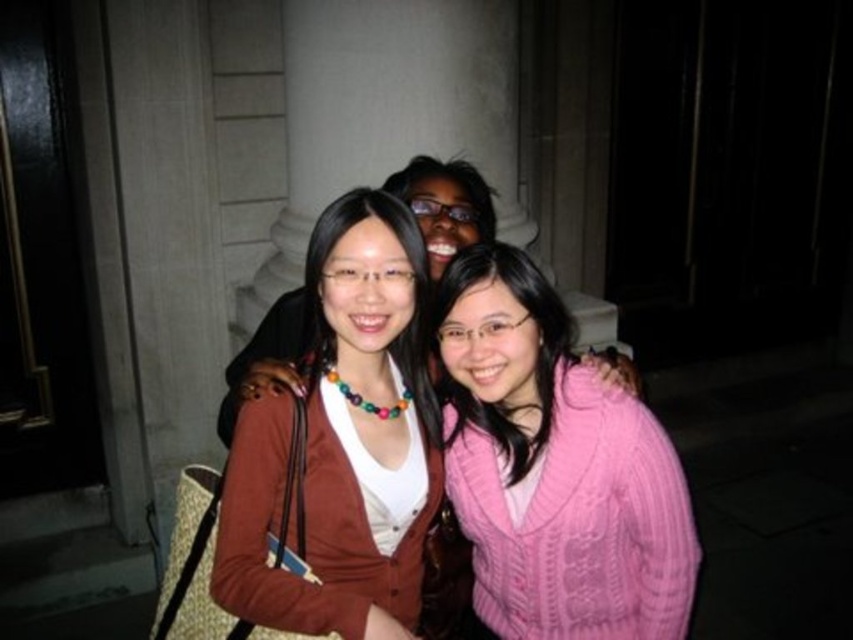
Which is above, pink knitted sweater at center or matte brown sweater at center?

Positioned higher is matte brown sweater at center.

At what (x,y) coordinates should I click in order to perform the action: click on pink knitted sweater at center. Please return your answer as a coordinate pair (x, y). The image size is (853, 640). Looking at the image, I should click on (554, 468).

Where is `brown matte sweater at center`? This screenshot has height=640, width=853. brown matte sweater at center is located at coordinates (341, 436).

Who is taller, brown matte sweater at center or matte brown sweater at center?

brown matte sweater at center

Who is more distant from viewer, (x=416, y=419) or (x=247, y=388)?

Point (x=416, y=419)

Locate an element on the screen. This screenshot has height=640, width=853. brown matte sweater at center is located at coordinates [341, 436].

Between pink knitted sweater at center and brown matte sweater at center, which one is positioned higher?

brown matte sweater at center is higher up.

Describe the element at coordinates (554, 468) in the screenshot. I see `pink knitted sweater at center` at that location.

Is point (520, 394) more distant than point (355, 584)?

Yes, it is.

Identify the location of pink knitted sweater at center. (554, 468).